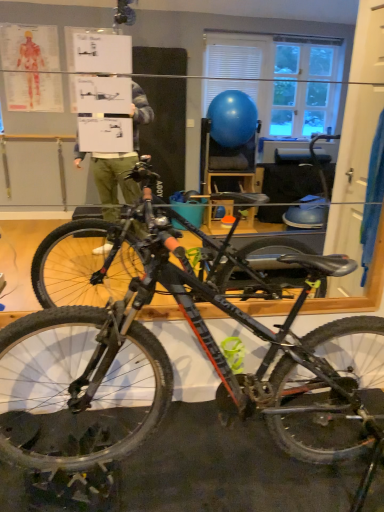
What are the coordinates of `shiny metallic bicycle at center` in the screenshot? It's located at (170, 362).

Measure the distance between point (56, 377) and camera.

Point (56, 377) is 6.64 feet from camera.

This screenshot has width=384, height=512. What do you see at coordinates (170, 362) in the screenshot?
I see `shiny metallic bicycle at center` at bounding box center [170, 362].

What do you see at coordinates (313, 417) in the screenshot? The height and width of the screenshot is (512, 384). I see `black rubber tire at lower right` at bounding box center [313, 417].

I want to click on black rubber tire at lower right, so click(313, 417).

Identify the location of shiny metallic bicycle at center. (170, 362).

Does black rubber tire at lower right appear on the right side of shiny metallic bicycle at center?

Indeed, black rubber tire at lower right is positioned on the right side of shiny metallic bicycle at center.

Which object is further away from the camera taking this photo, black rubber tire at lower right or shiny metallic bicycle at center?

black rubber tire at lower right is more distant.

Between point (334, 368) and point (312, 366), which one is positioned behind?

The point (334, 368) is farther.

From the image's perspective, relative to shiny metallic bicycle at center, is black rubber tire at lower right above or below?

Based on their image positions, black rubber tire at lower right is located beneath shiny metallic bicycle at center.

From a real-world perspective, is black rubber tire at lower right located higher than shiny metallic bicycle at center?

Incorrect, from a real-world perspective, black rubber tire at lower right is lower than shiny metallic bicycle at center.

Looking at this image, which object is wider, black rubber tire at lower right or shiny metallic bicycle at center?

shiny metallic bicycle at center.

Based on the photo, which of these two, black rubber tire at lower right or shiny metallic bicycle at center, stands taller?

With more height is shiny metallic bicycle at center.

Does black rubber tire at lower right have a smaller size compared to shiny metallic bicycle at center?

Correct, black rubber tire at lower right occupies less space than shiny metallic bicycle at center.

Consider the image. Could shiny metallic bicycle at center be considered to be inside black rubber tire at lower right?

Actually, shiny metallic bicycle at center is outside black rubber tire at lower right.

Would you consider black rubber tire at lower right to be distant from shiny metallic bicycle at center?

They are positioned close to each other.

Could you tell me if black rubber tire at lower right is facing shiny metallic bicycle at center?

Yes, black rubber tire at lower right faces towards shiny metallic bicycle at center.

Measure the distance between black rubber tire at lower right and shiny metallic bicycle at center.

black rubber tire at lower right and shiny metallic bicycle at center are 12.19 inches apart.

Identify the location of bicycle wheel that appears behind the shiny metallic bicycle at center. This screenshot has height=512, width=384. (313, 417).

Is shiny metallic bicycle at center to the right of black rubber tire at lower right from the viewer's perspective?

No, shiny metallic bicycle at center is not to the right of black rubber tire at lower right.

Considering their positions, is shiny metallic bicycle at center located in front of or behind black rubber tire at lower right?

shiny metallic bicycle at center is in front of black rubber tire at lower right.

Considering the positions of points (2, 328) and (359, 342), is point (2, 328) closer to camera compared to point (359, 342)?

Yes, it is.

From the image's perspective, would you say shiny metallic bicycle at center is shown under black rubber tire at lower right?

No, from the image's perspective, shiny metallic bicycle at center is not beneath black rubber tire at lower right.

From a real-world perspective, is shiny metallic bicycle at center physically below black rubber tire at lower right?

No, from a real-world perspective, shiny metallic bicycle at center is not beneath black rubber tire at lower right.

Can you confirm if shiny metallic bicycle at center is wider than black rubber tire at lower right?

Correct, the width of shiny metallic bicycle at center exceeds that of black rubber tire at lower right.

Which of these two, shiny metallic bicycle at center or black rubber tire at lower right, stands taller?

With more height is shiny metallic bicycle at center.

Which of these two, shiny metallic bicycle at center or black rubber tire at lower right, is smaller?

With smaller size is black rubber tire at lower right.

Is black rubber tire at lower right inside shiny metallic bicycle at center?

Yes.

Is shiny metallic bicycle at center next to black rubber tire at lower right?

No, shiny metallic bicycle at center is not touching black rubber tire at lower right.

Is shiny metallic bicycle at center oriented towards black rubber tire at lower right?

No, shiny metallic bicycle at center is not turned towards black rubber tire at lower right.

How far apart are shiny metallic bicycle at center and black rubber tire at lower right?

shiny metallic bicycle at center and black rubber tire at lower right are 12.19 inches apart.

In the image, there is a black rubber tire at lower right. Identify the location of bicycle above it (from the image's perspective). The width and height of the screenshot is (384, 512). (170, 362).

Identify the location of bicycle on the left side of black rubber tire at lower right. (170, 362).

You are a GUI agent. You are given a task and a screenshot of the screen. Output one action in this format:
    pyautogui.click(x=<x>, y=<y>)
    Task: Click on the bicycle above the black rubber tire at lower right (from the image's perspective)
    The width and height of the screenshot is (384, 512).
    Given the screenshot: What is the action you would take?
    pyautogui.click(x=170, y=362)